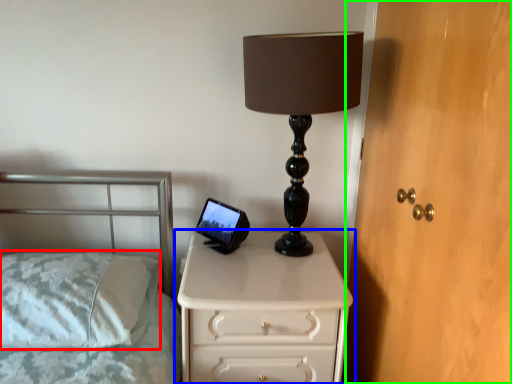
Question: Based on their relative distances, which object is nearer to pillow (highlighted by a red box)? Choose from chest of drawers (highlighted by a blue box) and dresser (highlighted by a green box).

Choices:
 (A) chest of drawers
 (B) dresser

Answer: (A)